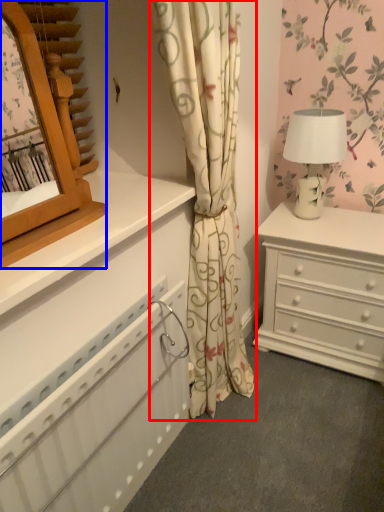
Question: Which object is closer to the camera taking this photo, curtain (highlighted by a red box) or mirror (highlighted by a blue box)?

Choices:
 (A) curtain
 (B) mirror

Answer: (B)